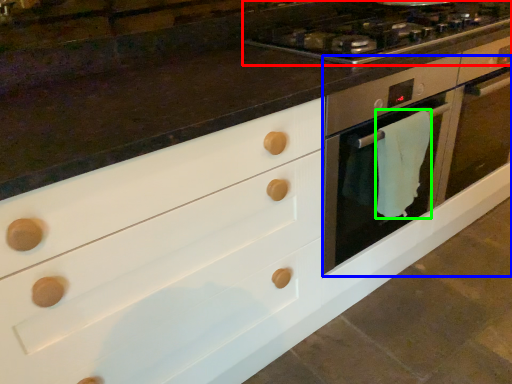
Question: Which object is the farthest from gas stove (highlighted by a red box)? Choose among these: oven (highlighted by a blue box) or material (highlighted by a green box).

Choices:
 (A) oven
 (B) material

Answer: (B)